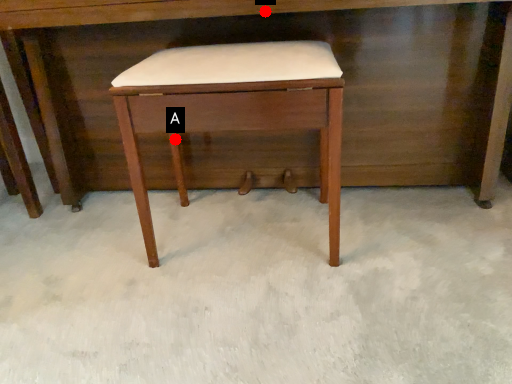
Question: Two points are circled on the image, labeled by A and B beside each circle. Which point is closer to the camera?

Choices:
 (A) A is closer
 (B) B is closer

Answer: (B)